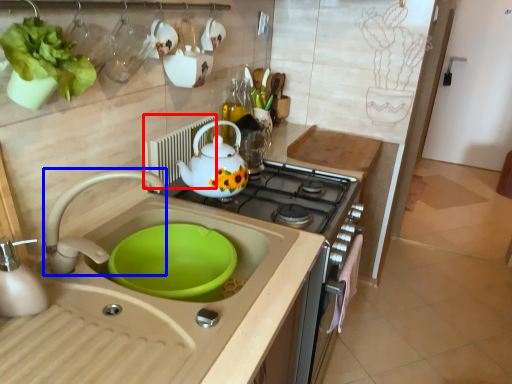
Question: Among these objects, which one is farthest to the camera, appliance (highlighted by a red box) or tap (highlighted by a blue box)?

Choices:
 (A) appliance
 (B) tap

Answer: (A)